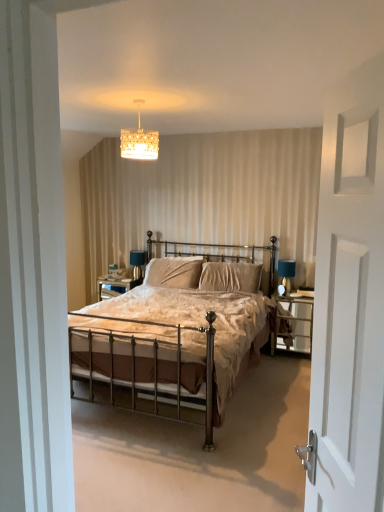
Question: Is matte black table lamp at right inside or outside of bronze metal bed at center?

Choices:
 (A) inside
 (B) outside

Answer: (B)

Question: Based on their sizes in the image, would you say matte black table lamp at right is bigger or smaller than bronze metal bed at center?

Choices:
 (A) big
 (B) small

Answer: (B)

Question: Based on their relative distances, which object is nearer to the matte black table lamp at right?

Choices:
 (A) metallic silver nightstand at right
 (B) white matte screen door at right
 (C) velvet beige pillow at center, placed as the 2th pillow when sorted from left to right
 (D) gold textured chandelier at upper center
 (E) velvet beige pillow at center, the 2th pillow in the right-to-left sequence

Answer: (A)

Question: Which object is positioned closest to the matte black table lamp at right?

Choices:
 (A) velvet beige pillow at center, the 2th pillow in the right-to-left sequence
 (B) metallic silver nightstand at right
 (C) gold textured chandelier at upper center
 (D) velvet beige pillow at center, placed as the 2th pillow when sorted from left to right
 (E) white matte screen door at right

Answer: (B)